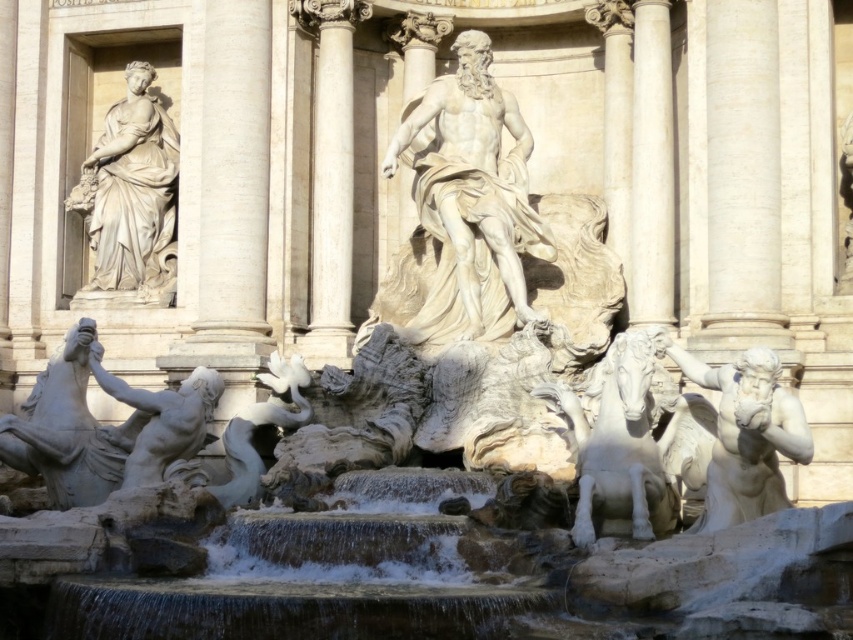
Question: Does white marble statue at center lie in front of white marble statue at lower left?

Choices:
 (A) yes
 (B) no

Answer: (B)

Question: Which object is farther from the camera taking this photo?

Choices:
 (A) white marble column at center
 (B) white marble statue at upper left

Answer: (B)

Question: Where is white marble column at center located in relation to white marble column at right in the image?

Choices:
 (A) above
 (B) below

Answer: (B)

Question: Does white marble statue at upper left appear over white marble horse at center-right?

Choices:
 (A) no
 (B) yes

Answer: (B)

Question: Which object is farther from the camera taking this photo?

Choices:
 (A) white marble statue at lower left
 (B) white marble column at right

Answer: (B)

Question: Which of these objects is positioned farthest from the white marble statue at lower left?

Choices:
 (A) white marble statue at upper left
 (B) white marble column at center
 (C) white marble statue at center
 (D) white marble horse at lower left

Answer: (A)